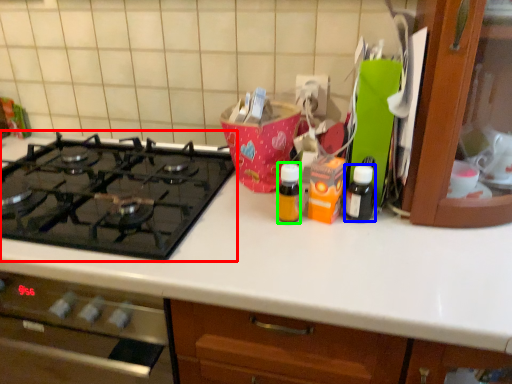
Question: Based on their relative distances, which object is farther from gas stove (highlighted by a red box)? Choose from bottle (highlighted by a blue box) and bottle (highlighted by a green box).

Choices:
 (A) bottle
 (B) bottle

Answer: (A)